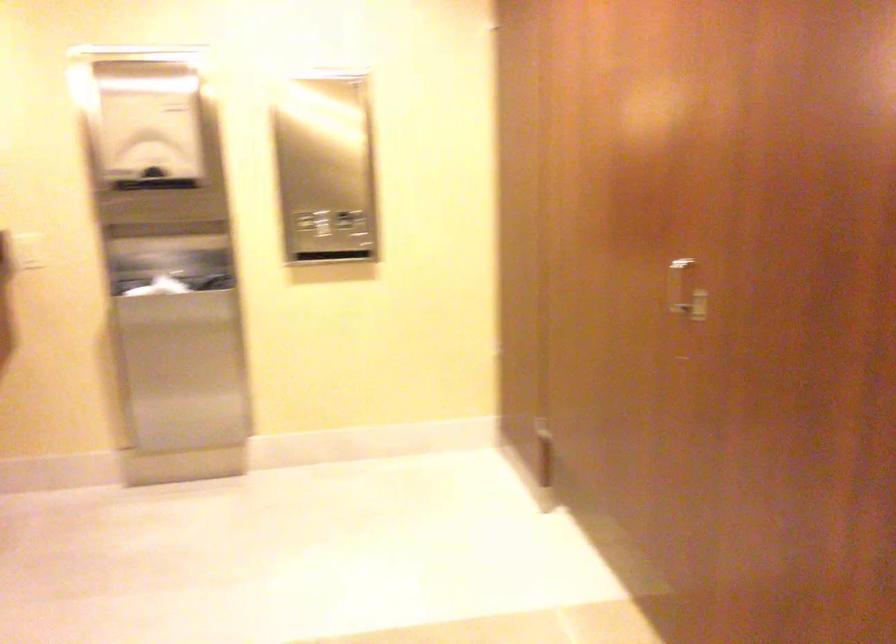
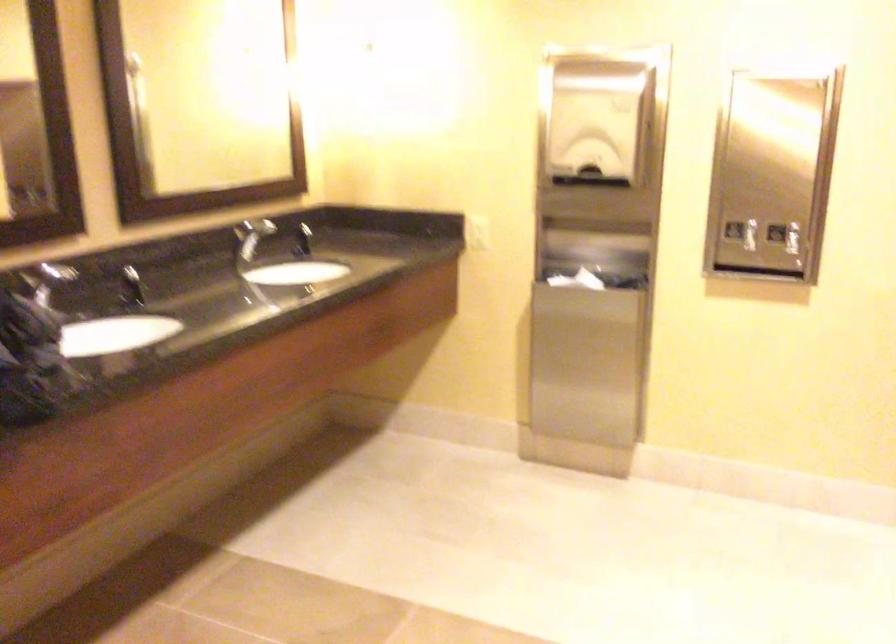
Question: The camera is either moving clockwise (left) or counter-clockwise (right) around the object. The first image is from the beginning of the video and the second image is from the end. Is the camera moving left or right when shooting the video?

Choices:
 (A) Left
 (B) Right

Answer: (B)